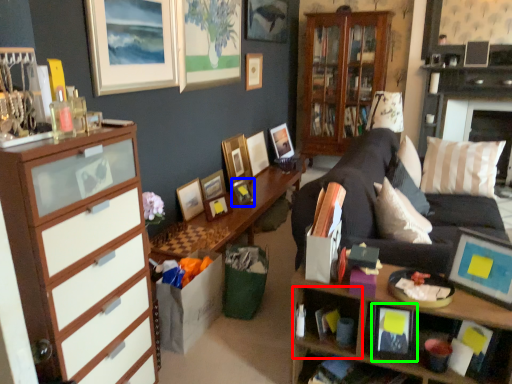
Question: Which object is the closest to the cabinet (highlighted by a red box)? Choose among these: picture frame (highlighted by a blue box) or picture frame (highlighted by a green box).

Choices:
 (A) picture frame
 (B) picture frame

Answer: (B)